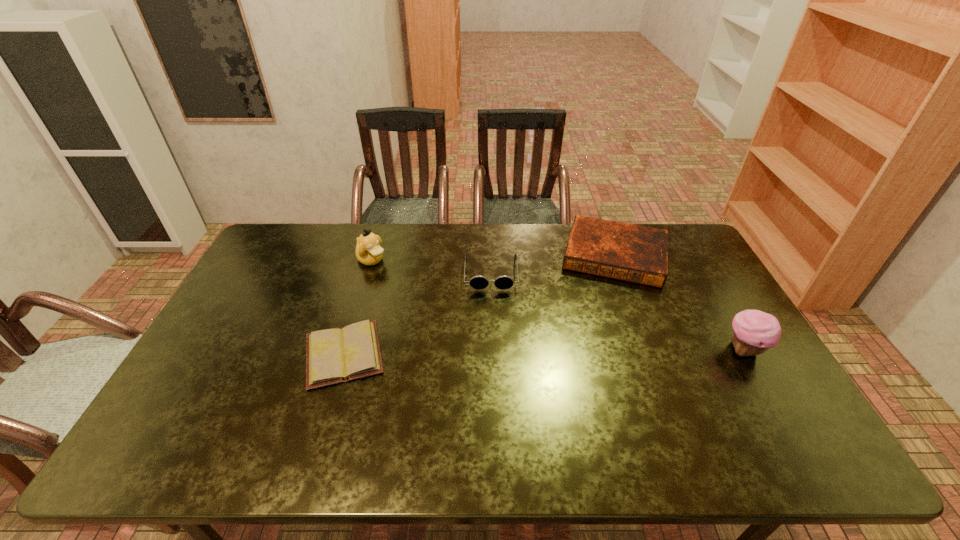
What are the coordinates of `free point between the diary and the cupcake` in the screenshot? It's located at (544, 352).

Where is `vacant area between the duckling and the fourth object from left to right`? vacant area between the duckling and the fourth object from left to right is located at coordinates click(x=493, y=258).

The image size is (960, 540). I want to click on vacant area between the diary and the third object from left to right, so click(x=418, y=313).

Where is `unoccupied position between the duckling and the shortest object`? This screenshot has height=540, width=960. unoccupied position between the duckling and the shortest object is located at coordinates (358, 307).

Locate an element on the screen. The width and height of the screenshot is (960, 540). unoccupied position between the duckling and the cupcake is located at coordinates (558, 305).

At what (x,y) coordinates should I click in order to perform the action: click on free space between the diary and the duckling. Please return your answer as a coordinate pair (x, y). Looking at the image, I should click on (358, 307).

Identify the location of object that is the second closest to the Bible. (754, 332).

Where is `the third closest object to the rightmost object`? the third closest object to the rightmost object is located at coordinates 337,355.

At what (x,y) coordinates should I click in order to perform the action: click on free space that satisfies the following two spatial constraints: 1. on the back side of the duckling; 2. on the left side of the diary. Please return your answer as a coordinate pair (x, y). The width and height of the screenshot is (960, 540). Looking at the image, I should click on (372, 260).

The height and width of the screenshot is (540, 960). In order to click on free point that satisfies the following two spatial constraints: 1. on the back side of the duckling; 2. on the right side of the shortest object in this screenshot , I will do click(372, 260).